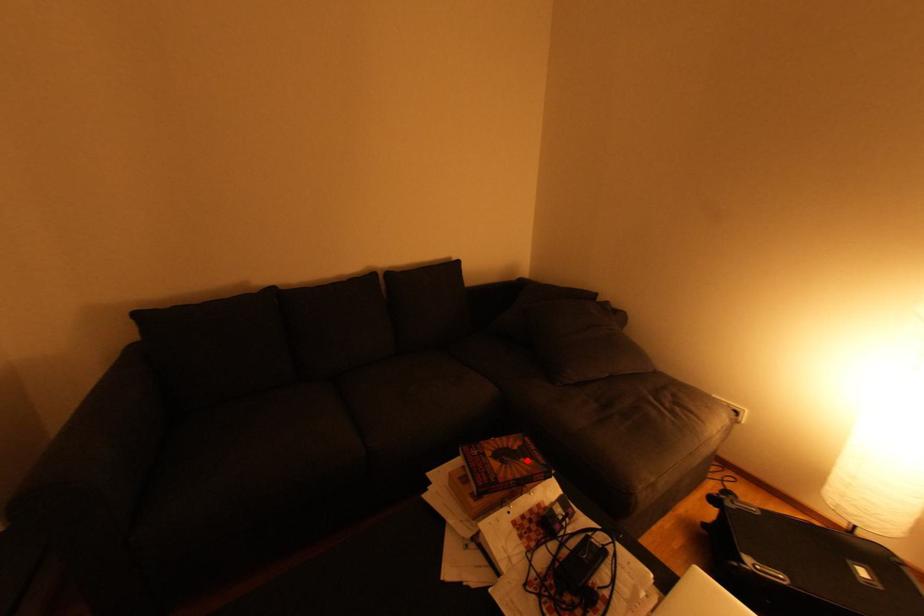
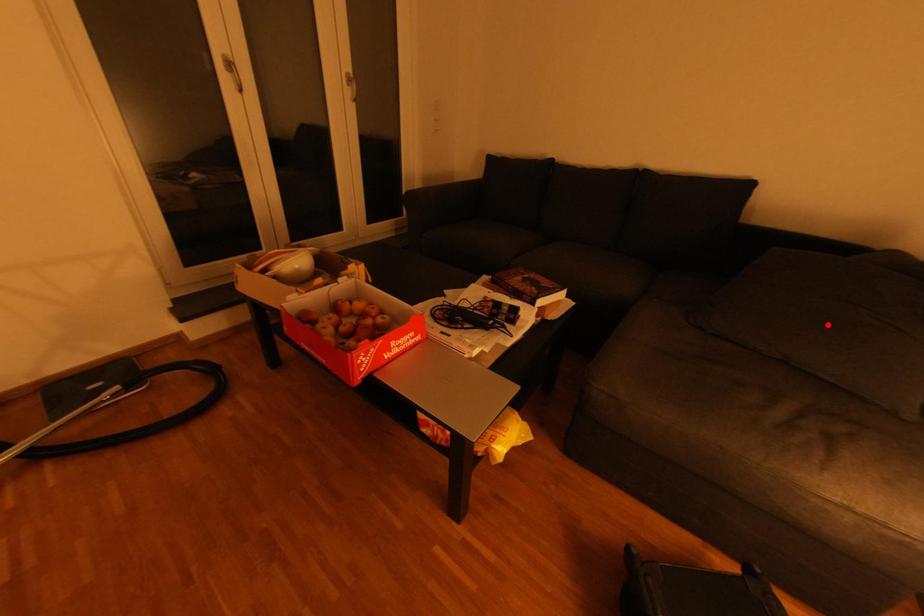
I am providing you with two images of the same scene from different viewpoints. A red point is marked on the first image and another point is marked on the second image. Is the marked point in image1 the same physical position as the marked point in image2?

No